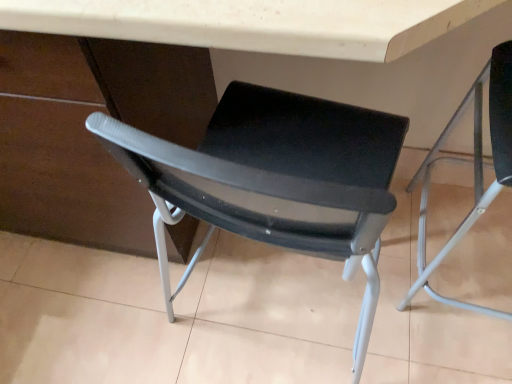
Question: In terms of width, does black mesh chair at center, which appears as the 1th chair when viewed from the left, look wider or thinner when compared to matte plastic table at center?

Choices:
 (A) wide
 (B) thin

Answer: (A)

Question: From the image's perspective, relative to matte plastic table at center, is black mesh chair at center, marked as the second chair in a right-to-left arrangement, above or below?

Choices:
 (A) below
 (B) above

Answer: (A)

Question: Which is farther from the matte plastic table at center?

Choices:
 (A) black mesh chair at center, which appears as the 1th chair when viewed from the left
 (B) matte black chair at right, acting as the 2th chair starting from the left

Answer: (B)

Question: Which object is positioned farthest from the matte plastic table at center?

Choices:
 (A) matte black chair at right, acting as the 2th chair starting from the left
 (B) black mesh chair at center, marked as the second chair in a right-to-left arrangement

Answer: (A)